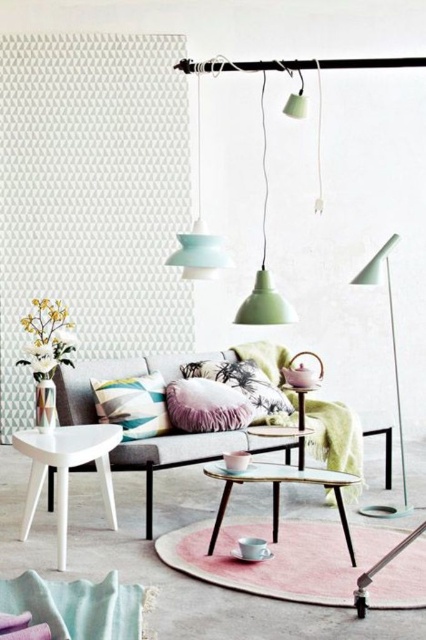
Is striped fabric pillow at center to the right of matte green pendant light at center from the viewer's perspective?

In fact, striped fabric pillow at center is to the left of matte green pendant light at center.

Locate an element on the screen. Image resolution: width=426 pixels, height=640 pixels. striped fabric pillow at center is located at coordinates (132, 404).

Which is in front, point (161, 428) or point (262, 131)?

Point (161, 428)

Locate an element on the screen. The image size is (426, 640). striped fabric pillow at center is located at coordinates click(132, 404).

Can you confirm if velvet purple pillow at center is positioned to the left of mint glossy pendant light at center?

No, velvet purple pillow at center is not to the left of mint glossy pendant light at center.

Based on the photo, can you confirm if velvet purple pillow at center is thinner than mint glossy pendant light at center?

No.

What do you see at coordinates (206, 406) in the screenshot?
I see `velvet purple pillow at center` at bounding box center [206, 406].

You are a GUI agent. You are given a task and a screenshot of the screen. Output one action in this format:
    pyautogui.click(x=<x>, y=<y>)
    Task: Click on the velvet purple pillow at center
    The width and height of the screenshot is (426, 640).
    Given the screenshot: What is the action you would take?
    (206, 406)

In the scene shown: Does velvet purple pillow at center have a lesser height compared to matte green pendant light at upper center?

Yes, velvet purple pillow at center is shorter than matte green pendant light at upper center.

In the scene shown: Does velvet purple pillow at center appear on the left side of matte green pendant light at upper center?

Correct, you'll find velvet purple pillow at center to the left of matte green pendant light at upper center.

What do you see at coordinates (206, 406) in the screenshot?
I see `velvet purple pillow at center` at bounding box center [206, 406].

The image size is (426, 640). Identify the location of velvet purple pillow at center. (206, 406).